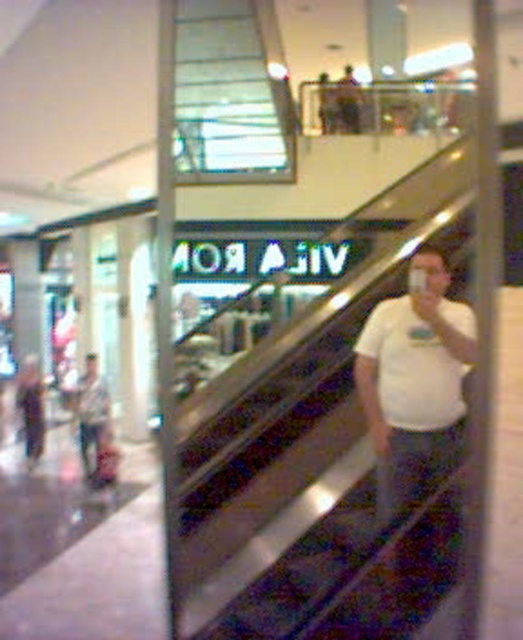
You are standing at the point with coordinates point (x=94, y=364) in the mall. You want to walk to the point with coordinates point (x=380, y=460). Which direction should you move relative to your current position?

You should move forward because point (x=380, y=460) is in front of point (x=94, y=364).